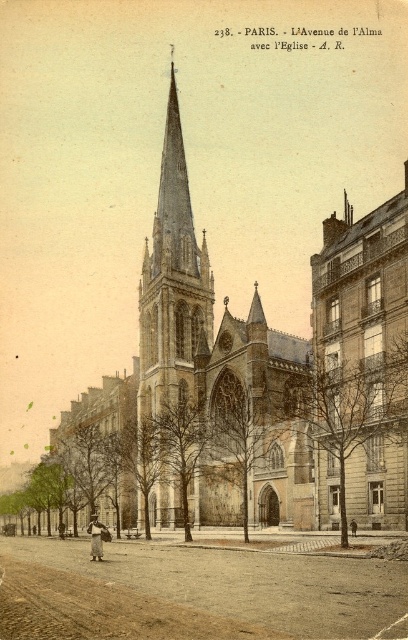
Based on the scene described, which object is positioned lower in the image, the brown stone church at center or the stone gothic tower at center?

The brown stone church at center is positioned below the stone gothic tower at center, so it is lower in the image.

You are a tourist standing on the Avenue de lAlma and want to take a photo of the brown stone church at center and the stone gothic tower at center. Which one will appear larger in your photo?

The brown stone church at center will appear larger in your photo because it is closer to the viewer than the stone gothic tower at center.